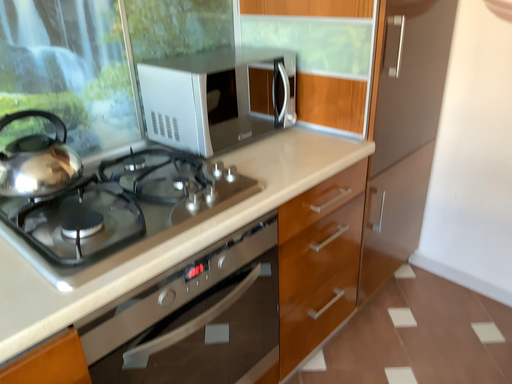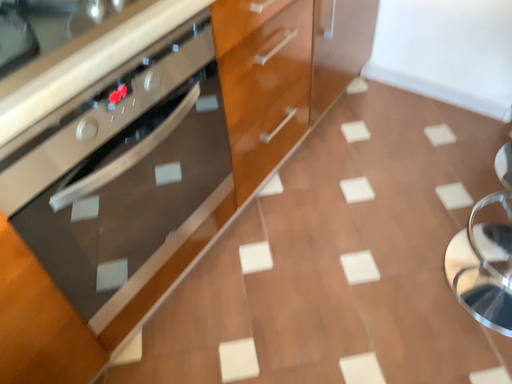
Question: Which way did the camera rotate in the video?

Choices:
 (A) rotated left
 (B) rotated right

Answer: (B)